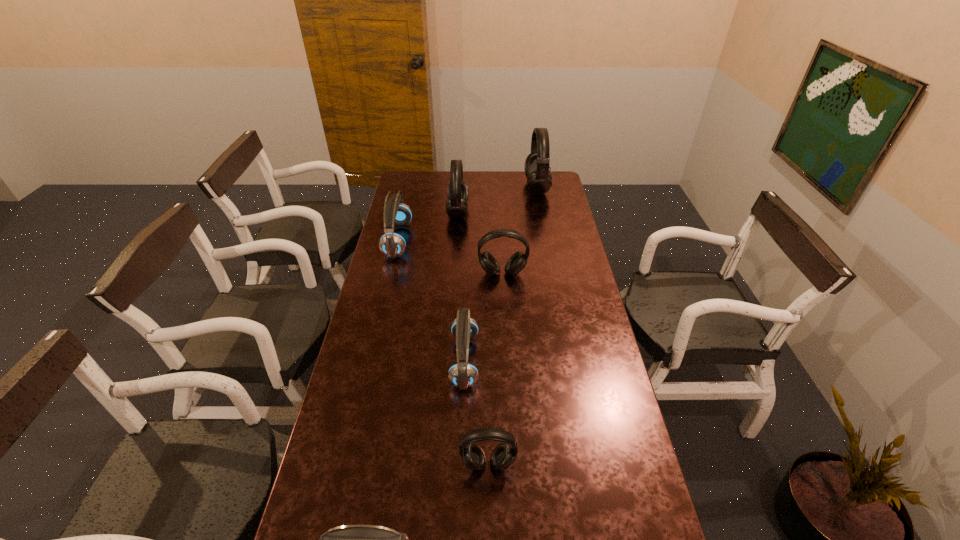
Locate an element on the screen. The image size is (960, 540). object that is at the left edge is located at coordinates (392, 244).

Identify the location of object that is positioned at the right edge. Image resolution: width=960 pixels, height=540 pixels. (539, 179).

Locate an element on the screen. The width and height of the screenshot is (960, 540). object at the far right corner is located at coordinates (539, 179).

What are the coordinates of `vacant space at the far edge` in the screenshot? It's located at (430, 191).

The width and height of the screenshot is (960, 540). Identify the location of free point at the left edge. (407, 281).

Where is `vacant space at the right edge of the desktop`? vacant space at the right edge of the desktop is located at coordinates (572, 291).

The height and width of the screenshot is (540, 960). I want to click on vacant space at the far left corner, so click(428, 190).

Locate an element on the screen. empty space that is in between the leftmost gray headset and the biggest blue headset is located at coordinates (428, 226).

Locate an element on the screen. The image size is (960, 540). blank region between the second smallest gray headset and the farthest blue headset is located at coordinates (450, 256).

Where is `free space between the second tallest headset and the rightmost blue headset`? The image size is (960, 540). free space between the second tallest headset and the rightmost blue headset is located at coordinates (461, 286).